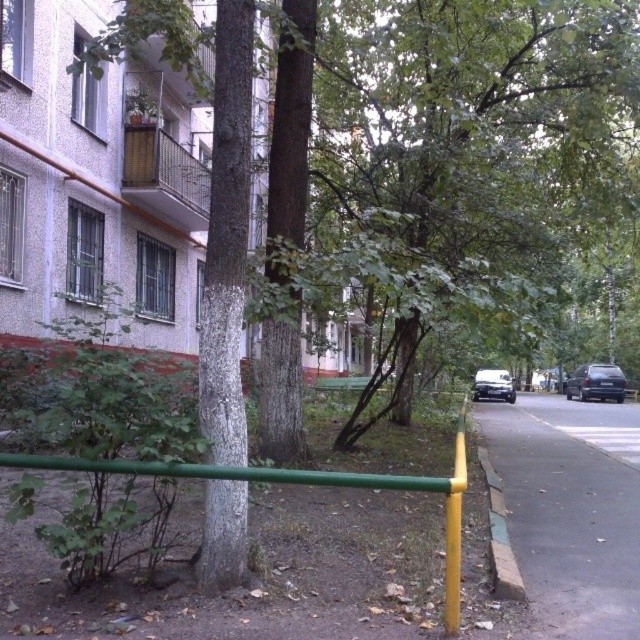
You are a city planner assessing the urban space. You need to determine if the green leafy tree at center and the shiny silver van at right can fit side by side in a parking space that is 3 meters wide. Given their widths, can both fit without overlapping?

The green leafy tree at center is wider than the shiny silver van at right. However, trees cannot be moved, so only the van can fit in the parking space. The tree occupies more space and is stationary, making it impossible for both to fit side by side in the 3 meter wide space.

You are standing at the sidewalk in the urban street scene. You see two points marked on the image. The first point is at coordinates point [305,109] and the second is at point [589,516]. If you were to walk from the first point to the second point, would you be moving towards the residential building or away from it?

The point [305,109] is behind point [589,516]. Since you are moving from the first point to the second point, you are moving away from the residential building.

You are a delivery person driving a 5.5 meter long shiny silver van at right. You need to park it between the green leafy tree at center and a fire hydrant located 10 meters behind the tree. Is there enough space?

The distance between the green leafy tree at center and the shiny silver van at right is 17.24 meters. Since the van is 5.5 meters long and needs to be parked 10 meters behind the tree, subtracting the 10 meters from the total distance leaves 7.24 meters of space available. This is more than enough to accommodate the van, so yes, there is sufficient space.